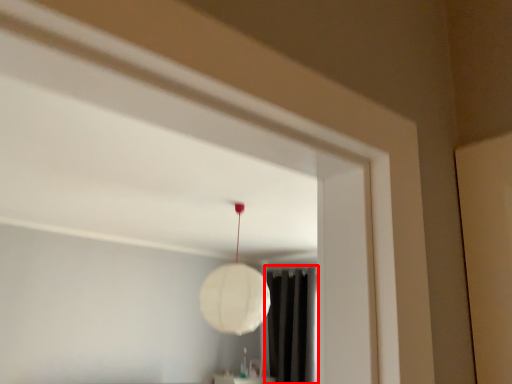
Question: In this image, where is curtain (annotated by the red box) located relative to lamp?

Choices:
 (A) left
 (B) right

Answer: (B)